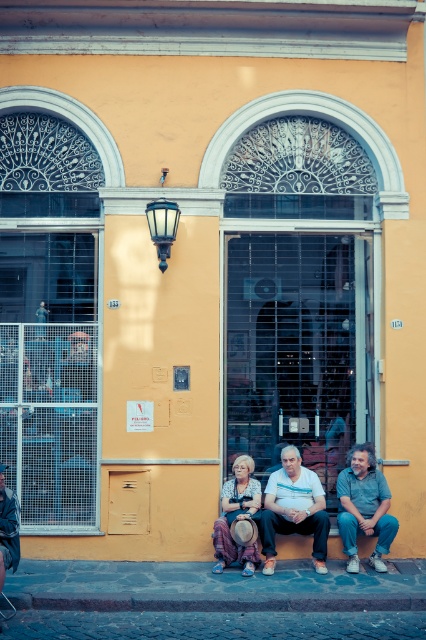
Question: Which point is farther from the camera taking this photo?

Choices:
 (A) (239, 557)
 (B) (5, 496)
 (C) (382, 605)
 (D) (342, 531)

Answer: (D)

Question: Which object appears farthest from the camera in this image?

Choices:
 (A) white cotton shirt at center
 (B) striped fabric dress at center
 (C) denim jacket at lower left
 (D) denim jeans at lower right

Answer: (D)

Question: Does gray concrete curb at lower center have a smaller size compared to denim jacket at lower left?

Choices:
 (A) no
 (B) yes

Answer: (B)

Question: Is white cotton shirt at center further to camera compared to striped fabric dress at center?

Choices:
 (A) no
 (B) yes

Answer: (B)

Question: Considering the real-world distances, which object is farthest from the denim jeans at lower right?

Choices:
 (A) gray concrete curb at lower center
 (B) white cotton shirt at center
 (C) denim jacket at lower left
 (D) striped fabric dress at center

Answer: (C)

Question: Does white cotton shirt at center have a lesser width compared to striped fabric dress at center?

Choices:
 (A) no
 (B) yes

Answer: (A)